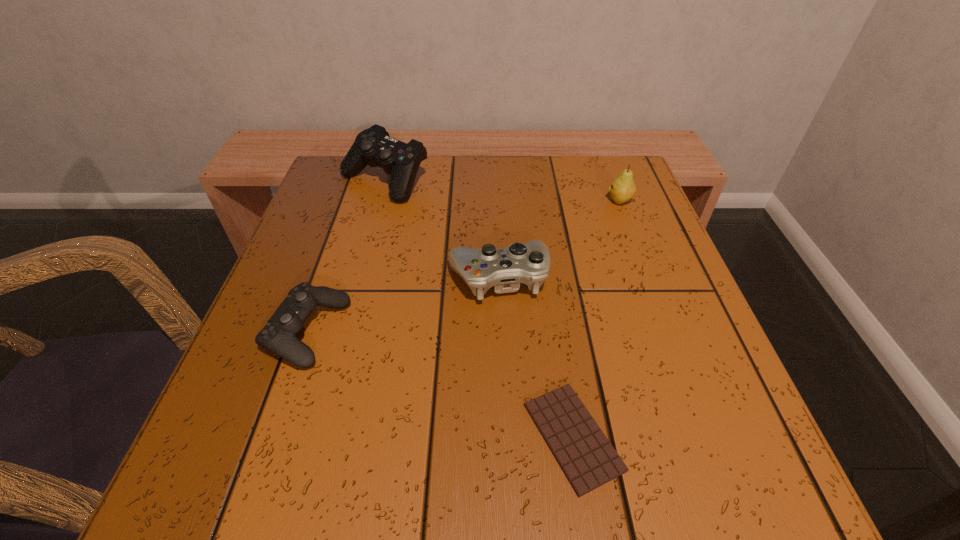
Identify the location of free space located on the back of the fourth tallest object. (336, 251).

Where is `vacant space located 0.260m on the back of the chocolate bar`? vacant space located 0.260m on the back of the chocolate bar is located at coordinates (546, 266).

The image size is (960, 540). Find the location of `control at the far edge`. control at the far edge is located at coordinates (373, 146).

Image resolution: width=960 pixels, height=540 pixels. I want to click on pear positioned at the far edge, so click(x=623, y=188).

In order to click on object at the near edge in this screenshot , I will do `click(588, 460)`.

Locate an element on the screen. Image resolution: width=960 pixels, height=540 pixels. object present at the right edge is located at coordinates point(623,188).

At what (x,y) coordinates should I click in order to perform the action: click on object located at the far left corner. Please return your answer as a coordinate pair (x, y). Looking at the image, I should click on (373, 146).

Identify the location of object present at the far right corner. This screenshot has height=540, width=960. (623, 188).

This screenshot has height=540, width=960. Find the location of `vacant space at the far edge of the desktop`. vacant space at the far edge of the desktop is located at coordinates (496, 164).

Identify the location of vacant space at the near edge of the desktop. (540, 467).